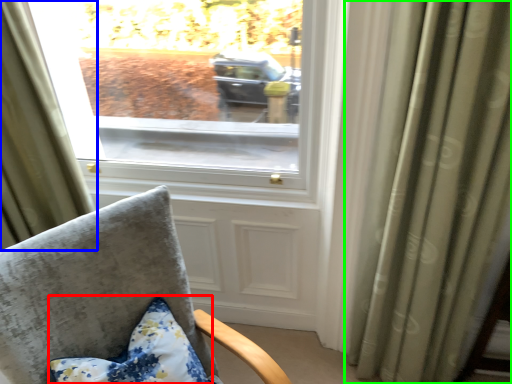
Question: Estimate the real-world distances between objects in this image. Which object is closer to pillow (highlighted by a red box), curtain (highlighted by a blue box) or curtain (highlighted by a green box)?

Choices:
 (A) curtain
 (B) curtain

Answer: (A)